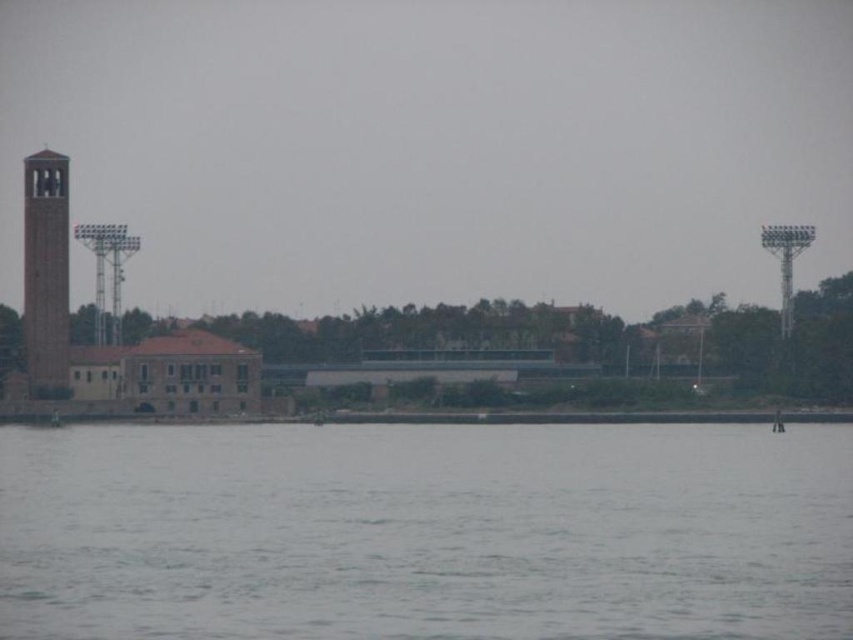
Does gray water at lower center lie in front of smooth stone bell tower at left?

That is True.

From the picture: Which of these two, gray water at lower center or smooth stone bell tower at left, stands shorter?

Standing shorter between the two is gray water at lower center.

Between point (602, 470) and point (33, 294), which one is positioned in front?

Positioned in front is point (602, 470).

Find the location of `gray water at lower center`. gray water at lower center is located at coordinates (425, 532).